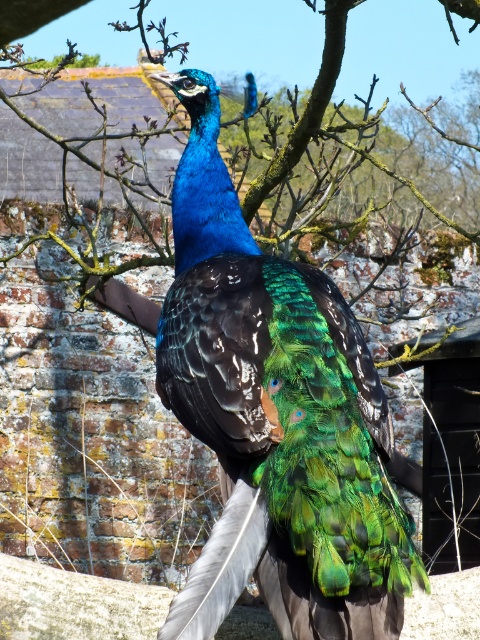
Question: From the image, what is the correct spatial relationship of shiny blue peacock at center in relation to green leafy tree at center?

Choices:
 (A) right
 (B) left

Answer: (A)

Question: Which point is farther to the camera?

Choices:
 (A) (231, 13)
 (B) (347, 321)

Answer: (A)

Question: Which point is closer to the camera?

Choices:
 (A) green leafy tree at center
 (B) shiny blue peacock at center

Answer: (A)

Question: Is shiny blue peacock at center positioned in front of green leafy tree at center?

Choices:
 (A) yes
 (B) no

Answer: (B)

Question: Where is shiny blue peacock at center located in relation to green leafy tree at center in the image?

Choices:
 (A) below
 (B) above

Answer: (A)